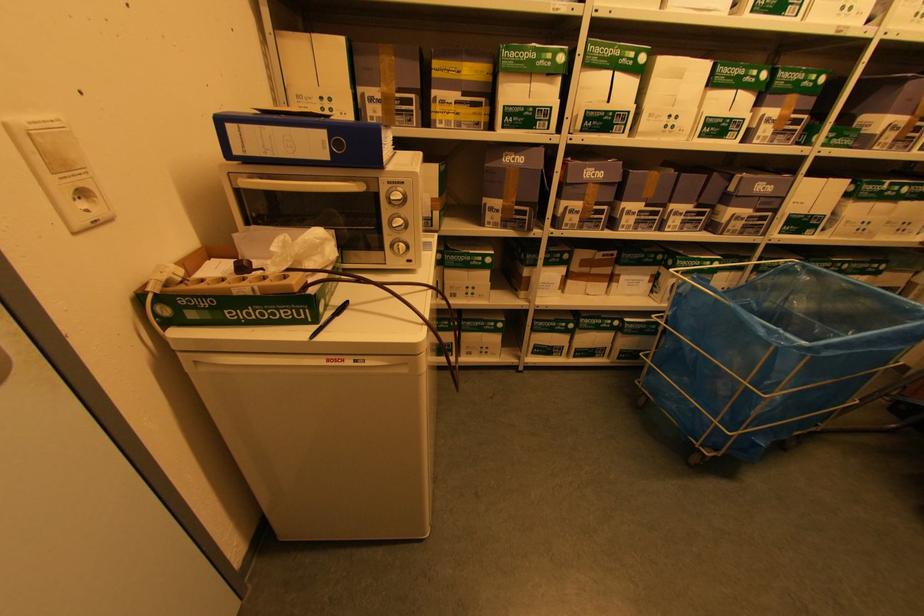
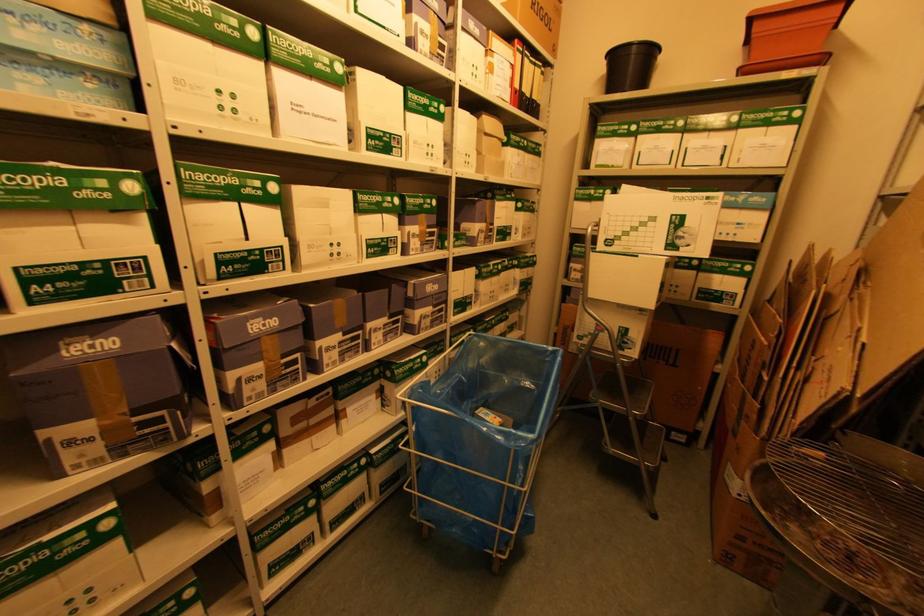
Question: The images are taken continuously from a first-person perspective. In which direction is your viewpoint rotating?

Choices:
 (A) Left
 (B) Right
 (C) Up
 (D) Down

Answer: (B)